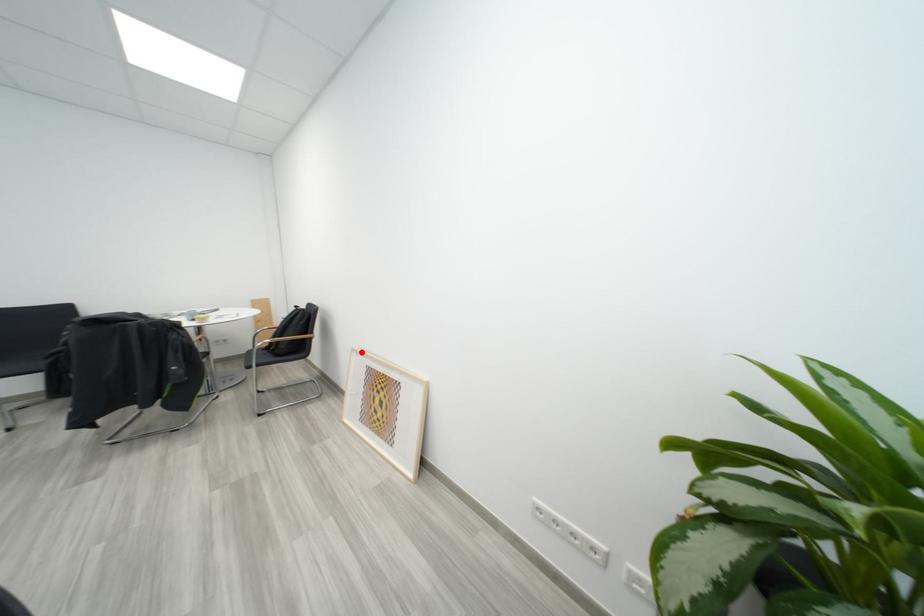
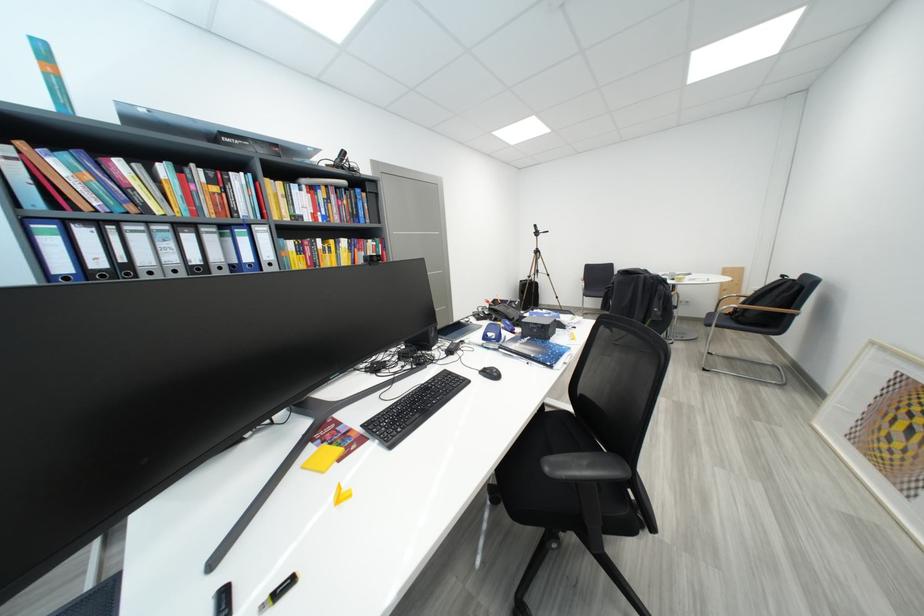
Where in the second image is the point corresponding to the highlighted location from the first image?

(881, 346)